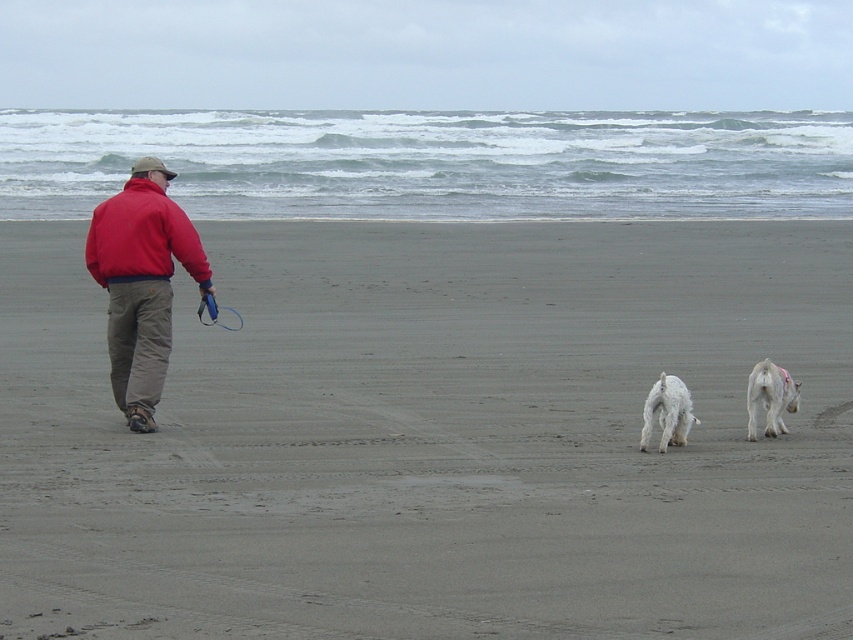
How distant is gray sand at center from white fluffy dog at center?

gray sand at center and white fluffy dog at center are 3.38 meters apart from each other.

Between gray sand at center and white fluffy dog at center, which one appears on the left side from the viewer's perspective?

From the viewer's perspective, gray sand at center appears more on the left side.

Identify the location of gray sand at center. (434, 436).

Does red fleece jacket at left appear on the left side of red fleece sweatshirt at left?

Incorrect, red fleece jacket at left is not on the left side of red fleece sweatshirt at left.

Is red fleece jacket at left taller than red fleece sweatshirt at left?

Yes, red fleece jacket at left is taller than red fleece sweatshirt at left.

This screenshot has height=640, width=853. I want to click on red fleece jacket at left, so click(141, 282).

Does gray sand at center have a lesser height compared to white fluffy dog at right?

In fact, gray sand at center may be taller than white fluffy dog at right.

Can you confirm if gray sand at center is wider than white fluffy dog at right?

Indeed, gray sand at center has a greater width compared to white fluffy dog at right.

Which is in front, point (408, 348) or point (752, 426)?

Positioned in front is point (752, 426).

I want to click on gray sand at center, so click(x=434, y=436).